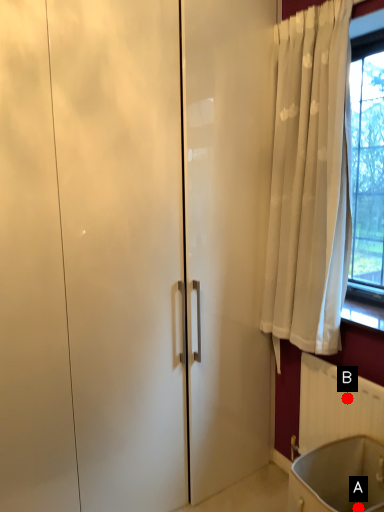
Question: Two points are circled on the image, labeled by A and B beside each circle. Which point is farther from the camera taking this photo?

Choices:
 (A) A is further
 (B) B is further

Answer: (B)